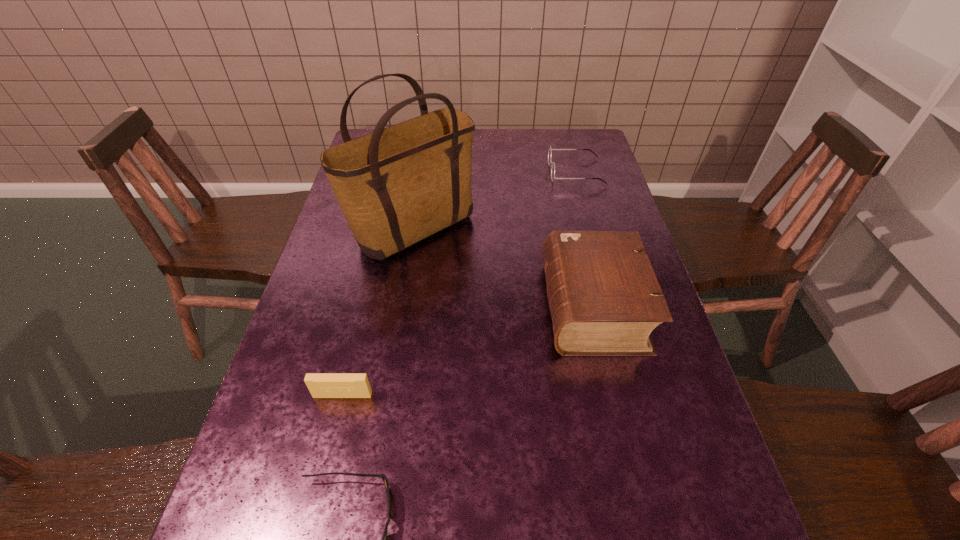
Where is `blank space located 0.160m on the front-facing side of the spectacles`? blank space located 0.160m on the front-facing side of the spectacles is located at coordinates coord(500,172).

The height and width of the screenshot is (540, 960). Find the location of `vacant region located on the front-facing side of the spectacles`. vacant region located on the front-facing side of the spectacles is located at coordinates [479, 172].

The height and width of the screenshot is (540, 960). What are the coordinates of `object that is at the far edge` in the screenshot? It's located at (550, 150).

This screenshot has height=540, width=960. What are the coordinates of `tote bag present at the left edge` in the screenshot? It's located at (396, 186).

Where is `videotape that is at the left edge`? This screenshot has width=960, height=540. videotape that is at the left edge is located at coordinates (321, 385).

In order to click on Bible that is at the right edge in this screenshot , I will do `click(604, 298)`.

Find the location of `spectacles at the right edge`. spectacles at the right edge is located at coordinates (550, 150).

You are a GUI agent. You are given a task and a screenshot of the screen. Output one action in this format:
    pyautogui.click(x=<x>, y=<y>)
    Task: Click on the object that is at the far right corner
    
    Given the screenshot: What is the action you would take?
    pyautogui.click(x=550, y=150)

The image size is (960, 540). In the image, there is a desktop. In order to click on vacant space at the left edge in this screenshot , I will do point(310,490).

I want to click on free region at the right edge of the desktop, so click(599, 208).